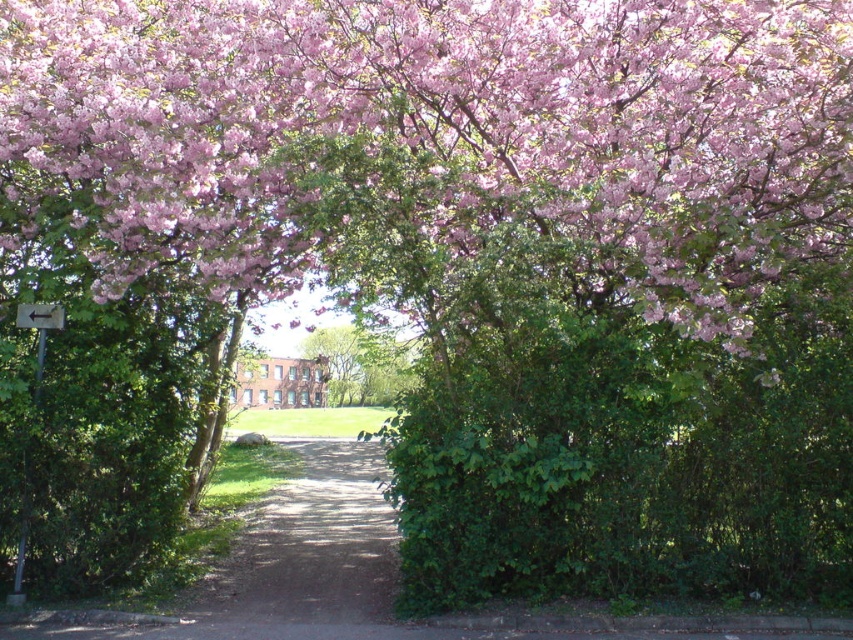
You are a gardener who wants to install a decorative light between the pink bloom at upper center and the dirt path at center. The light requires a minimum of 4 meters of space between the two objects to function properly. Based on the scene description, will the light work properly?

The pink bloom at upper center and dirt path at center are 3.76 meters apart from each other, which is less than the required 4 meters. Therefore, the light will not function properly due to insufficient space.

You are standing at the point labeled as point (x=306, y=557) in the image. What is the object you are standing on?

The point (x=306, y=557) corresponds to the dirt path at center, so you are standing on the dirt path at center.